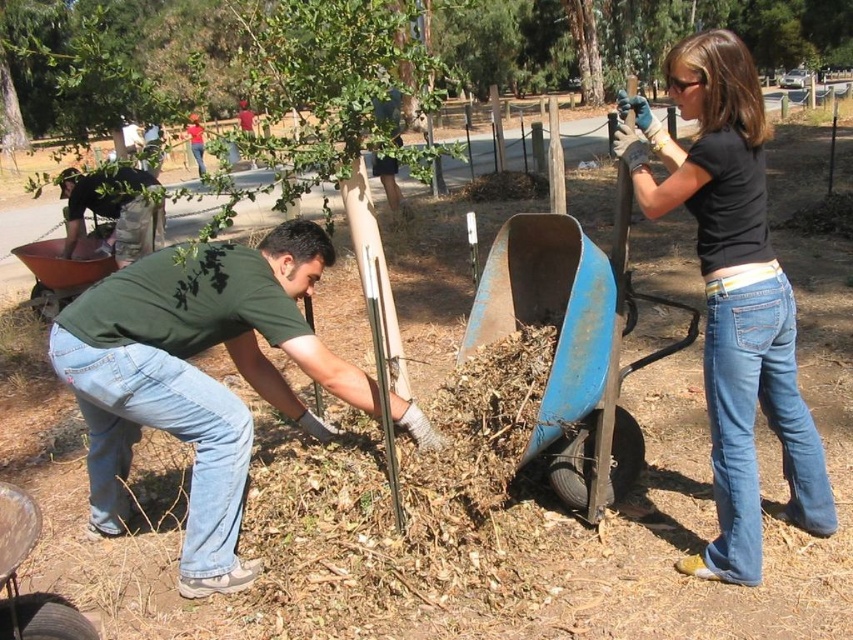
Does green matte shirt at lower left appear under black cotton shirt at upper right?

Indeed, green matte shirt at lower left is positioned under black cotton shirt at upper right.

Which is above, green matte shirt at lower left or black cotton shirt at upper right?

black cotton shirt at upper right is above.

Locate an element on the screen. This screenshot has height=640, width=853. green matte shirt at lower left is located at coordinates (196, 378).

Identify the location of green matte shirt at lower left. (196, 378).

Based on the photo, which of these two, green leafy tree at upper center or black cotton shirt at upper right, stands shorter?

black cotton shirt at upper right is shorter.

From the picture: Can you confirm if green leafy tree at upper center is bigger than black cotton shirt at upper right?

Indeed, green leafy tree at upper center has a larger size compared to black cotton shirt at upper right.

What are the coordinates of `green leafy tree at upper center` in the screenshot? It's located at (624, 36).

Which is more to the right, green leafy tree at upper center or blue metal cart at lower center?

blue metal cart at lower center

Which is in front, point (647, 74) or point (567, 472)?

Point (567, 472) is in front.

Locate an element on the screen. green leafy tree at upper center is located at coordinates 624,36.